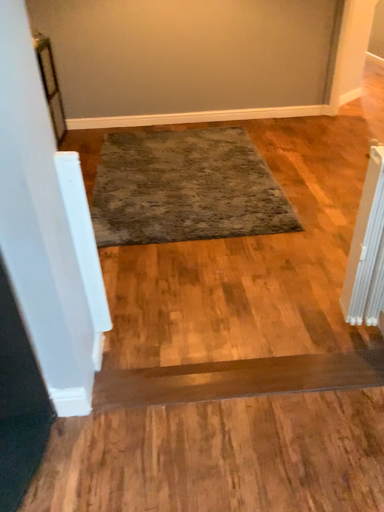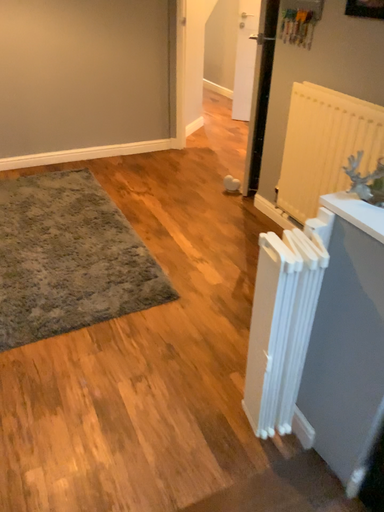
Question: How did the camera likely rotate when shooting the video?

Choices:
 (A) rotated right
 (B) rotated left

Answer: (A)